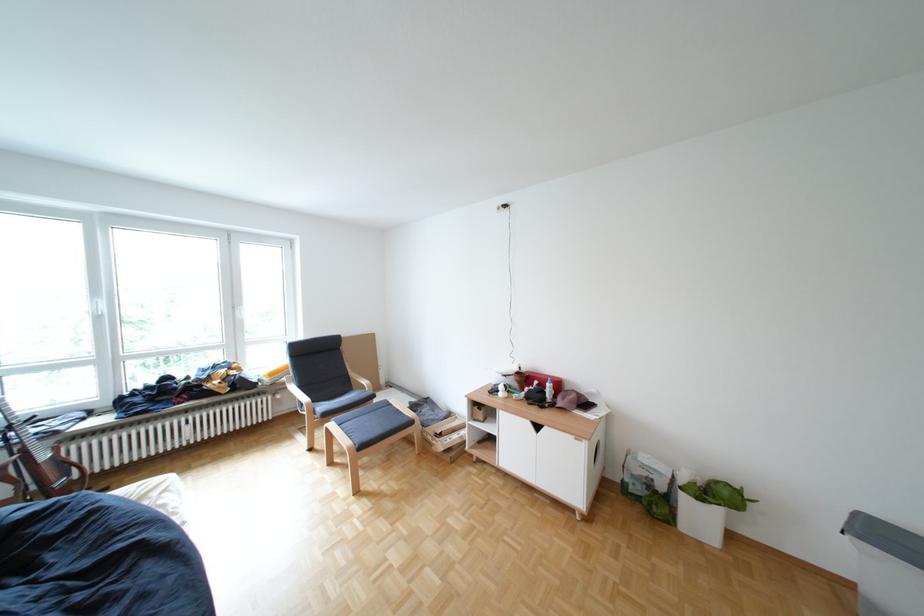
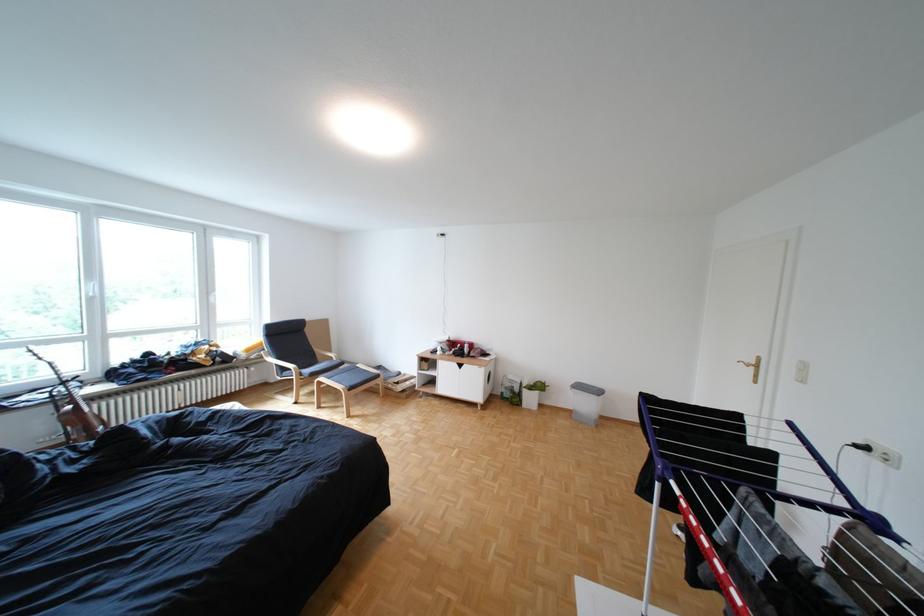
What movement of the cameraman would produce the second image?

The movement direction of the cameraman is left, backward.